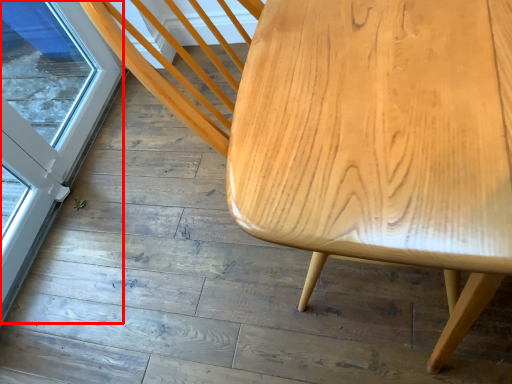
Question: Where is screen door (annotated by the red box) located in relation to table in the image?

Choices:
 (A) left
 (B) right

Answer: (A)